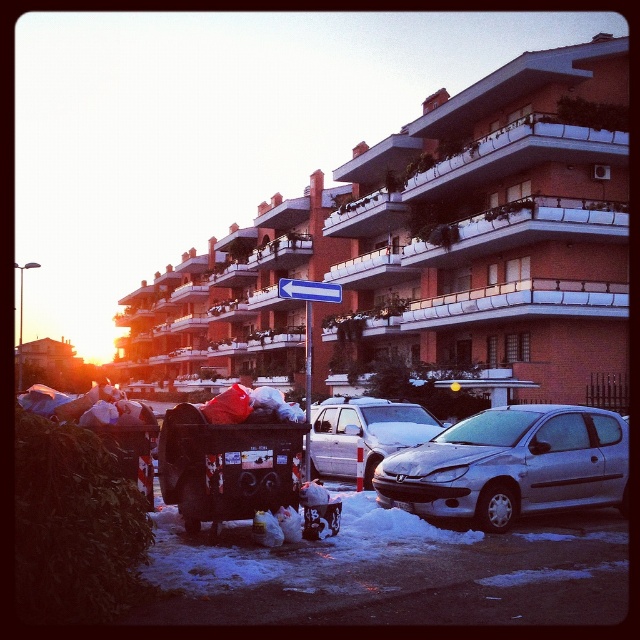
Question: Which object is farther from the camera taking this photo?

Choices:
 (A) metallic garbage cart at lower left
 (B) silver metallic car at lower right
 (C) satin silver car at center

Answer: (C)

Question: Does silver metallic car at lower right have a lesser width compared to satin silver car at center?

Choices:
 (A) no
 (B) yes

Answer: (A)

Question: Is metallic garbage cart at lower left in front of satin silver car at center?

Choices:
 (A) no
 (B) yes

Answer: (B)

Question: Which of the following is the farthest from the observer?

Choices:
 (A) (388, 410)
 (B) (541, 445)
 (C) (182, 461)

Answer: (A)

Question: Which of the following is the farthest from the observer?

Choices:
 (A) satin silver car at center
 (B) silver metallic car at lower right
 (C) metallic garbage cart at lower left

Answer: (A)

Question: Is silver metallic car at lower right above satin silver car at center?

Choices:
 (A) no
 (B) yes

Answer: (B)